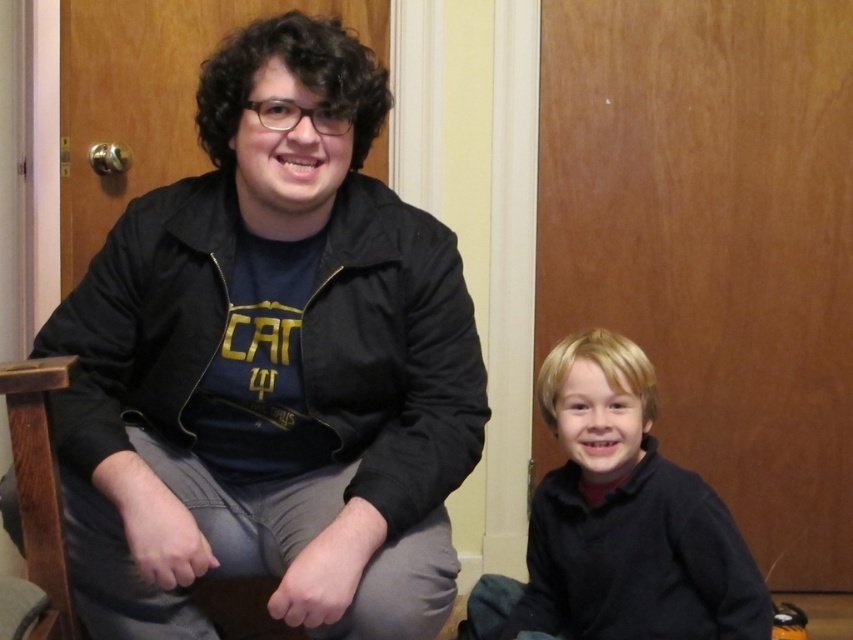
You are an interior designer planning to place a decorative item between the black matte jacket at left and the black matte sweater at lower right. Which side of the sweater should you place it on?

The black matte jacket at left is positioned on the left side of black matte sweater at lower right, so you should place the decorative item to the left of the sweater.

You are a tailor measuring garments for alterations. You see the black matte jacket at left and the wooden textured rocking chair at left in the scene. Which object requires a larger measurement tape to accurately assess its dimensions?

The black matte jacket at left requires a larger measurement tape because it is bigger than the wooden textured rocking chair at left.

You are taking a photo of two people sitting on chairs in a room. You want to focus on the person closer to the camera. Which of the two points, point (222, 312) or point (24, 465), should you focus on?

Point (222, 312) is further to the camera than point (24, 465), so you should focus on point (222, 312) to capture the person closer to the camera.